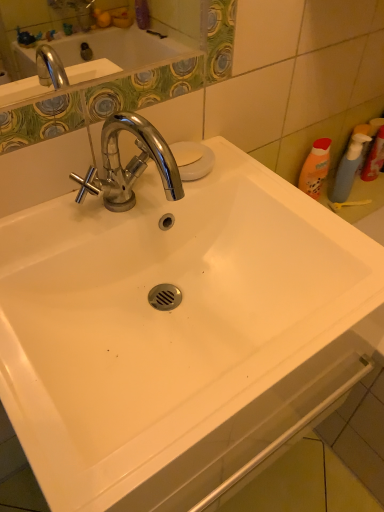
This screenshot has width=384, height=512. What do you see at coordinates (348, 168) in the screenshot?
I see `translucent blue spray bottle at right, the first cleaning product from the left` at bounding box center [348, 168].

Image resolution: width=384 pixels, height=512 pixels. In order to click on translucent plastic spray bottle at right, arranged as the second cleaning product when viewed from the left in this screenshot , I will do click(374, 157).

Is translucent plastic spray bottle at right, which is the first cleaning product in right-to-left order, a part of white matte soap at upper center?

That's incorrect, translucent plastic spray bottle at right, which is the first cleaning product in right-to-left order, is not inside white matte soap at upper center.

Considering the relative sizes of white matte soap at upper center and translucent plastic spray bottle at right, which is the first cleaning product in right-to-left order, in the image provided, is white matte soap at upper center thinner than translucent plastic spray bottle at right, which is the first cleaning product in right-to-left order,?

No, white matte soap at upper center is not thinner than translucent plastic spray bottle at right, which is the first cleaning product in right-to-left order.

Could you measure the distance between white matte soap at upper center and translucent plastic spray bottle at right, arranged as the second cleaning product when viewed from the left?

white matte soap at upper center and translucent plastic spray bottle at right, arranged as the second cleaning product when viewed from the left, are 26.77 inches apart from each other.

Does point (196, 160) appear closer or farther from the camera than point (382, 165)?

Point (196, 160).

Is translucent blue spray bottle at right, the first cleaning product from the left, not inside white matte soap at upper center?

Yes.

Can you tell me how much translucent blue spray bottle at right, the first cleaning product from the left, and white matte soap at upper center differ in facing direction?

The angular difference between translucent blue spray bottle at right, the first cleaning product from the left, and white matte soap at upper center is 0.411 degrees.

Looking at this image, from the image's perspective, which is above, translucent blue spray bottle at right, the second cleaning product in the right-to-left sequence, or white matte soap at upper center?

translucent blue spray bottle at right, the second cleaning product in the right-to-left sequence.

Which object is positioned more to the left, translucent plastic spray bottle at right, which is the first cleaning product in right-to-left order, or white matte soap at upper center?

Positioned to the left is white matte soap at upper center.

Identify the location of cleaning product that is the 2nd one when counting upward from the white matte soap at upper center (from the image's perspective). This screenshot has height=512, width=384. (374, 157).

Considering the positions of objects translucent plastic spray bottle at right, which is the first cleaning product in right-to-left order, and white matte soap at upper center in the image provided, who is in front, translucent plastic spray bottle at right, which is the first cleaning product in right-to-left order, or white matte soap at upper center?

white matte soap at upper center is more forward.

Is translucent plastic spray bottle at right, arranged as the second cleaning product when viewed from the left, wider than white matte soap at upper center?

Incorrect, the width of translucent plastic spray bottle at right, arranged as the second cleaning product when viewed from the left, does not surpass that of white matte soap at upper center.

Is translucent plastic spray bottle at right, which is the first cleaning product in right-to-left order, looking in the opposite direction of translucent blue spray bottle at right, the first cleaning product from the left?

No, translucent plastic spray bottle at right, which is the first cleaning product in right-to-left order, is not facing the opposite direction of translucent blue spray bottle at right, the first cleaning product from the left.

Does translucent plastic spray bottle at right, which is the first cleaning product in right-to-left order, have a lesser width compared to translucent blue spray bottle at right, the first cleaning product from the left?

In fact, translucent plastic spray bottle at right, which is the first cleaning product in right-to-left order, might be wider than translucent blue spray bottle at right, the first cleaning product from the left.

Which is behind, point (370, 164) or point (354, 175)?

Point (370, 164)

Which of these two, translucent plastic spray bottle at right, which is the first cleaning product in right-to-left order, or translucent blue spray bottle at right, the first cleaning product from the left, stands taller?

Standing taller between the two is translucent plastic spray bottle at right, which is the first cleaning product in right-to-left order.

From the image's perspective, which one is positioned lower, white matte soap at upper center or translucent blue spray bottle at right, the first cleaning product from the left?

white matte soap at upper center is shown below in the image.

From the picture: Is the position of white matte soap at upper center more distant than that of translucent blue spray bottle at right, the first cleaning product from the left?

No, white matte soap at upper center is in front of translucent blue spray bottle at right, the first cleaning product from the left.

Which of these two, white matte soap at upper center or translucent blue spray bottle at right, the first cleaning product from the left, stands shorter?

white matte soap at upper center is shorter.

From a real-world perspective, who is located lower, white matte soap at upper center or translucent blue spray bottle at right, the second cleaning product in the right-to-left sequence?

translucent blue spray bottle at right, the second cleaning product in the right-to-left sequence.

Is translucent blue spray bottle at right, the second cleaning product in the right-to-left sequence, aimed at translucent plastic spray bottle at right, which is the first cleaning product in right-to-left order?

No, translucent blue spray bottle at right, the second cleaning product in the right-to-left sequence, does not turn towards translucent plastic spray bottle at right, which is the first cleaning product in right-to-left order.

Is translucent blue spray bottle at right, the second cleaning product in the right-to-left sequence, not near translucent plastic spray bottle at right, arranged as the second cleaning product when viewed from the left?

No, there isn't a large distance between translucent blue spray bottle at right, the second cleaning product in the right-to-left sequence, and translucent plastic spray bottle at right, arranged as the second cleaning product when viewed from the left.

Is translucent blue spray bottle at right, the second cleaning product in the right-to-left sequence, thinner than translucent plastic spray bottle at right, arranged as the second cleaning product when viewed from the left?

Yes.

What are the coordinates of `soap on the left side of translucent plastic spray bottle at right, which is the first cleaning product in right-to-left order` in the screenshot? It's located at (186, 153).

The width and height of the screenshot is (384, 512). In order to click on soap that appears in front of the translucent blue spray bottle at right, the second cleaning product in the right-to-left sequence in this screenshot , I will do coord(186,153).

Based on their spatial positions, is white matte soap at upper center or translucent blue spray bottle at right, the second cleaning product in the right-to-left sequence, further from translucent plastic spray bottle at right, which is the first cleaning product in right-to-left order?

white matte soap at upper center is positioned further to the anchor translucent plastic spray bottle at right, which is the first cleaning product in right-to-left order.

Which object lies nearer to the anchor point translucent plastic spray bottle at right, which is the first cleaning product in right-to-left order, translucent blue spray bottle at right, the second cleaning product in the right-to-left sequence, or white matte soap at upper center?

Based on the image, translucent blue spray bottle at right, the second cleaning product in the right-to-left sequence, appears to be nearer to translucent plastic spray bottle at right, which is the first cleaning product in right-to-left order.

From the image, which object appears to be farther from translucent blue spray bottle at right, the first cleaning product from the left, translucent plastic spray bottle at right, arranged as the second cleaning product when viewed from the left, or white matte soap at upper center?

Based on the image, white matte soap at upper center appears to be further to translucent blue spray bottle at right, the first cleaning product from the left.

Looking at this image, which object lies nearer to the anchor point translucent blue spray bottle at right, the first cleaning product from the left, white matte soap at upper center or translucent plastic spray bottle at right, arranged as the second cleaning product when viewed from the left?

Based on the image, translucent plastic spray bottle at right, arranged as the second cleaning product when viewed from the left, appears to be nearer to translucent blue spray bottle at right, the first cleaning product from the left.

Estimate the real-world distances between objects in this image. Which object is further from white matte soap at upper center, translucent plastic spray bottle at right, arranged as the second cleaning product when viewed from the left, or translucent blue spray bottle at right, the first cleaning product from the left?

translucent plastic spray bottle at right, arranged as the second cleaning product when viewed from the left.

Based on the photo, based on their spatial positions, is translucent blue spray bottle at right, the second cleaning product in the right-to-left sequence, or translucent plastic spray bottle at right, arranged as the second cleaning product when viewed from the left, closer to white matte soap at upper center?

The object closer to white matte soap at upper center is translucent blue spray bottle at right, the second cleaning product in the right-to-left sequence.

Locate an element on the screen. cleaning product located between white matte soap at upper center and translucent plastic spray bottle at right, which is the first cleaning product in right-to-left order, in the left-right direction is located at coordinates (348, 168).